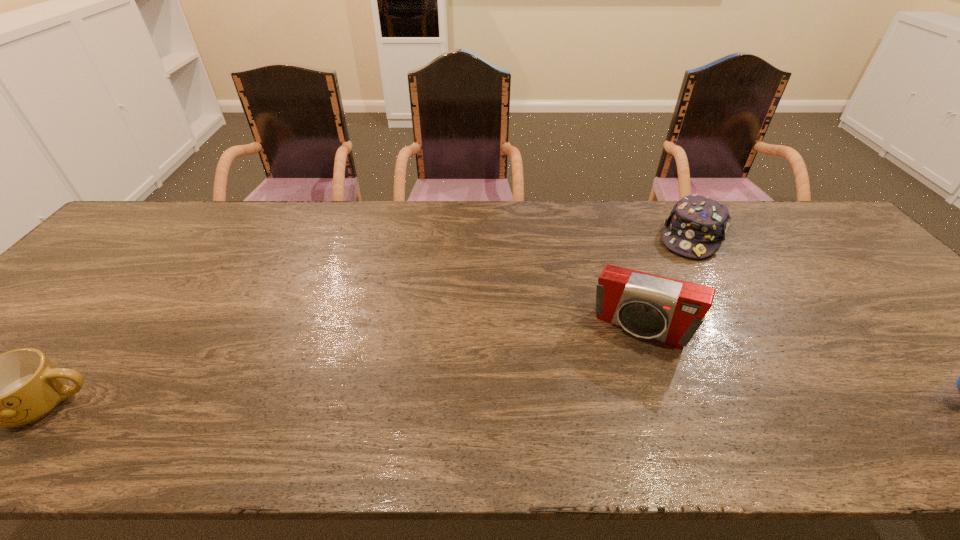
The image size is (960, 540). Find the location of `object present at the far edge`. object present at the far edge is located at coordinates (696, 225).

You are a GUI agent. You are given a task and a screenshot of the screen. Output one action in this format:
    pyautogui.click(x=<x>, y=<y>)
    Task: Click on the blank space at the far edge
    
    Given the screenshot: What is the action you would take?
    pyautogui.click(x=546, y=208)

You are a GUI agent. You are given a task and a screenshot of the screen. Output one action in this format:
    pyautogui.click(x=<x>, y=<y>)
    Task: Click on the vacant region at the near edge
    The height and width of the screenshot is (540, 960).
    Given the screenshot: What is the action you would take?
    pyautogui.click(x=415, y=375)

The image size is (960, 540). In the image, there is a desktop. Find the location of `vacant space at the left edge`. vacant space at the left edge is located at coordinates (137, 260).

The height and width of the screenshot is (540, 960). Find the location of `vacant space at the right edge of the desktop`. vacant space at the right edge of the desktop is located at coordinates (866, 287).

In the image, there is a desktop. Find the location of `free space at the far left corner`. free space at the far left corner is located at coordinates (147, 226).

The image size is (960, 540). What are the coordinates of `vacant area at the far right corner of the desktop` in the screenshot? It's located at (821, 233).

What are the coordinates of `object that is the closest to the nearest object` in the screenshot? It's located at (670, 311).

This screenshot has height=540, width=960. In order to click on object that is the second closest to the nearest object in this screenshot , I will do `click(696, 225)`.